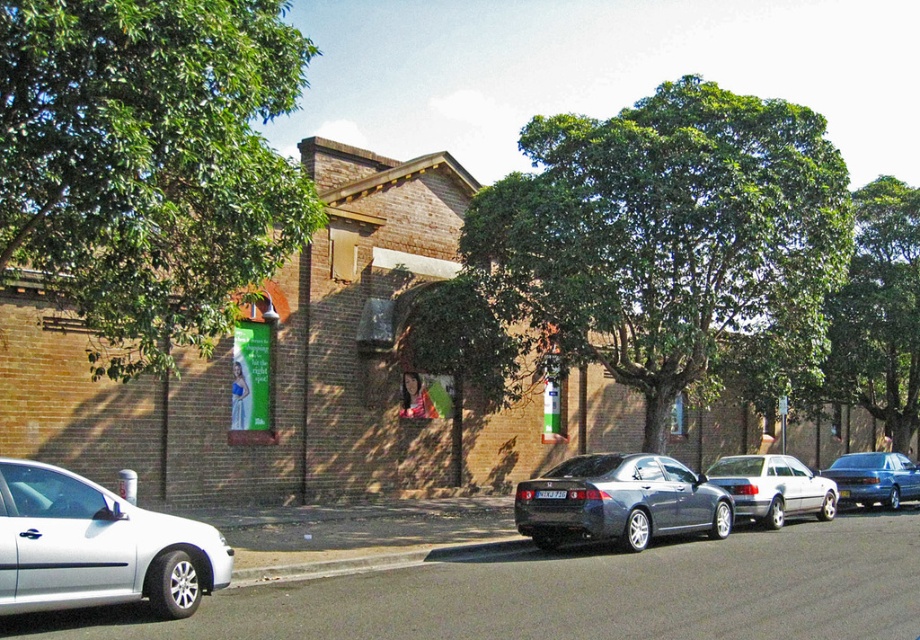
You are standing on the sidewalk looking at the two green leafy trees in the image. Which tree is closer to you, the green leafy tree at center or the green leafy tree at upper left?

The green leafy tree at center is closer to you because the green leafy tree at upper left is positioned behind it.